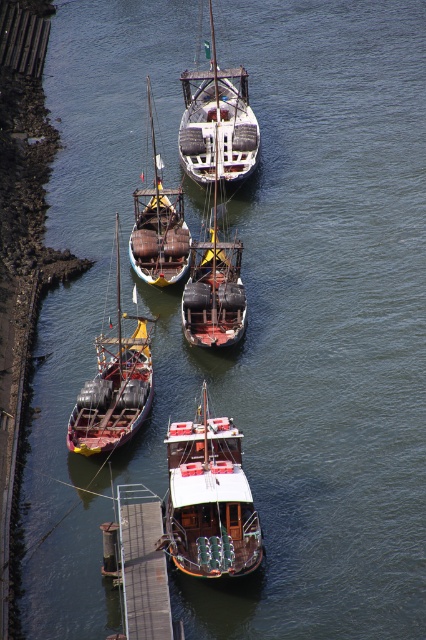
Describe the element at coordinates (218, 122) in the screenshot. I see `white matte sailboat at center` at that location.

Is point (236, 109) more distant than point (150, 189)?

Yes, it is.

Who is more distant from viewer, (207,144) or (175,243)?

The point (207,144) is behind.

Where is `white matte sailboat at center`? white matte sailboat at center is located at coordinates (218, 122).

What do you see at coordinates (143, 566) in the screenshot? I see `wooden dock at lower center` at bounding box center [143, 566].

Is wooden dock at lower center in front of rusty wooden boat at center?

Yes, it is.

You are a GUI agent. You are given a task and a screenshot of the screen. Output one action in this format:
    pyautogui.click(x=<x>, y=<y>)
    Task: Click on the wooden dock at lower center
    This screenshot has height=640, width=426.
    Given the screenshot: What is the action you would take?
    pyautogui.click(x=143, y=566)

Does wooden barrel boat at left have a lesser width compared to rusty wooden boat at center?

Correct, wooden barrel boat at left's width is less than rusty wooden boat at center's.

Does point (143, 360) lie in front of point (134, 253)?

Yes, point (143, 360) is in front of point (134, 253).

I want to click on wooden barrel boat at left, so click(114, 388).